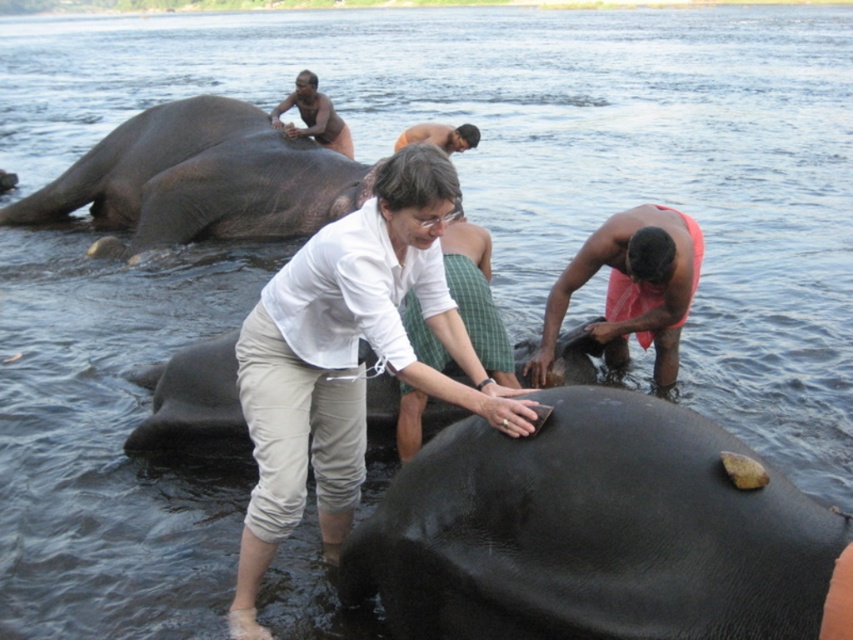
Question: Is smooth red cloth at center in front of gray matte elephant at upper left?

Choices:
 (A) no
 (B) yes

Answer: (B)

Question: Which point appears closest to the camera in this image?

Choices:
 (A) (775, 618)
 (B) (296, 209)
 (C) (479, 136)

Answer: (A)

Question: Estimate the real-world distances between objects in this image. Which object is farther from the smooth skin man at upper center?

Choices:
 (A) gray matte elephant at upper left
 (B) shiny black skin at center
 (C) smooth red cloth at center
 (D) orange cloth towel at lower right

Answer: (B)

Question: Can you confirm if orange cloth towel at lower right is smaller than smooth skin man at upper center?

Choices:
 (A) no
 (B) yes

Answer: (B)

Question: Based on their relative distances, which object is farther from the orange cloth towel at lower right?

Choices:
 (A) gray matte elephant at upper left
 (B) smooth skin man at upper center
 (C) shiny black skin at center

Answer: (A)

Question: Does smooth red cloth at center come in front of smooth skin man at upper center?

Choices:
 (A) no
 (B) yes

Answer: (B)